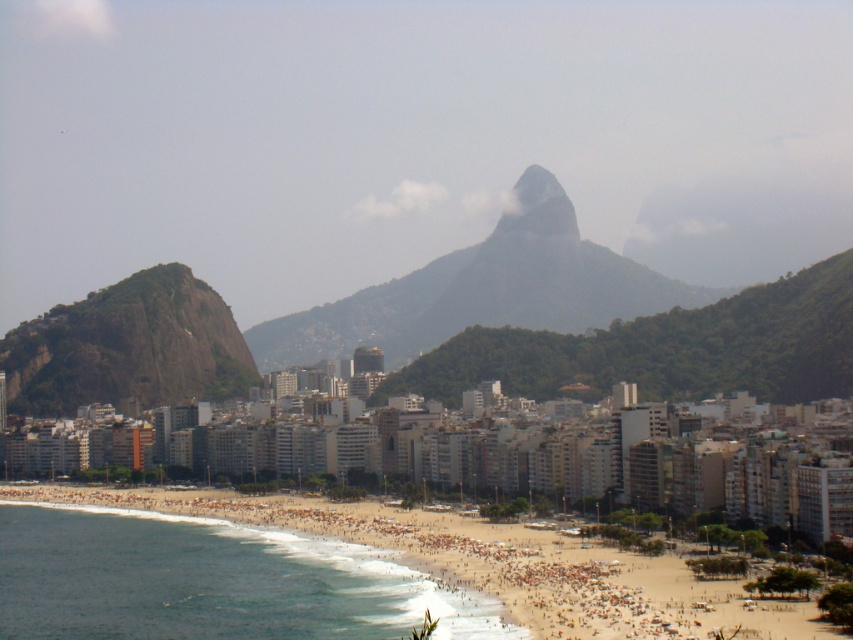
How much distance is there between rocky gray mountain at center and rough granite rock at left?

rocky gray mountain at center is 410.88 feet away from rough granite rock at left.

Does rocky gray mountain at center have a greater width compared to rough granite rock at left?

Yes.

Between point (663, 298) and point (45, 333), which one is positioned in front?

Point (45, 333)

The image size is (853, 640). In order to click on rocky gray mountain at center in this screenshot , I will do `click(485, 289)`.

Who is more distant from viewer, [10,586] or [675,301]?

The point [675,301] is behind.

Can you confirm if golden sand beach at lower left is positioned below rocky gray mountain at center?

Correct, golden sand beach at lower left is located below rocky gray mountain at center.

What do you see at coordinates (329, 579) in the screenshot? The width and height of the screenshot is (853, 640). I see `golden sand beach at lower left` at bounding box center [329, 579].

This screenshot has width=853, height=640. Find the location of `golden sand beach at lower left`. golden sand beach at lower left is located at coordinates (329, 579).

Is point (82, 605) positioned in front of point (219, 355)?

Yes.

Who is more distant from viewer, (354,612) or (111,371)?

The point (111,371) is behind.

Find the location of a particular element. The image size is (853, 640). golden sand beach at lower left is located at coordinates (329, 579).

This screenshot has height=640, width=853. Find the location of `golden sand beach at lower left`. golden sand beach at lower left is located at coordinates (329, 579).